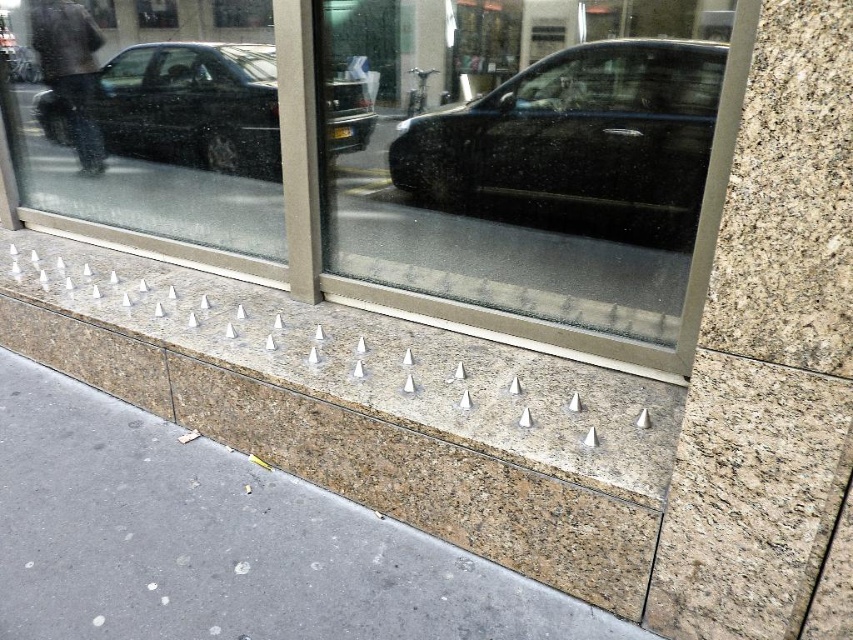
Question: Which object is the closest to the shiny black car at upper left?

Choices:
 (A) black glossy car at center
 (B) silver metallic spikes at center

Answer: (A)

Question: Does transparent glass shop window at center come in front of shiny black car at upper left?

Choices:
 (A) yes
 (B) no

Answer: (A)

Question: Among these points, which one is nearest to the camera?

Choices:
 (A) (48, 477)
 (B) (223, 100)
 (C) (393, 173)

Answer: (A)

Question: Is silver metallic spikes at center below shiny black car at upper left?

Choices:
 (A) yes
 (B) no

Answer: (A)

Question: Can you confirm if silver metallic spikes at center is positioned below shiny black car at upper left?

Choices:
 (A) no
 (B) yes

Answer: (B)

Question: Which object is the farthest from the transparent glass shop window at center?

Choices:
 (A) silver metallic spikes at center
 (B) black glossy car at center

Answer: (A)